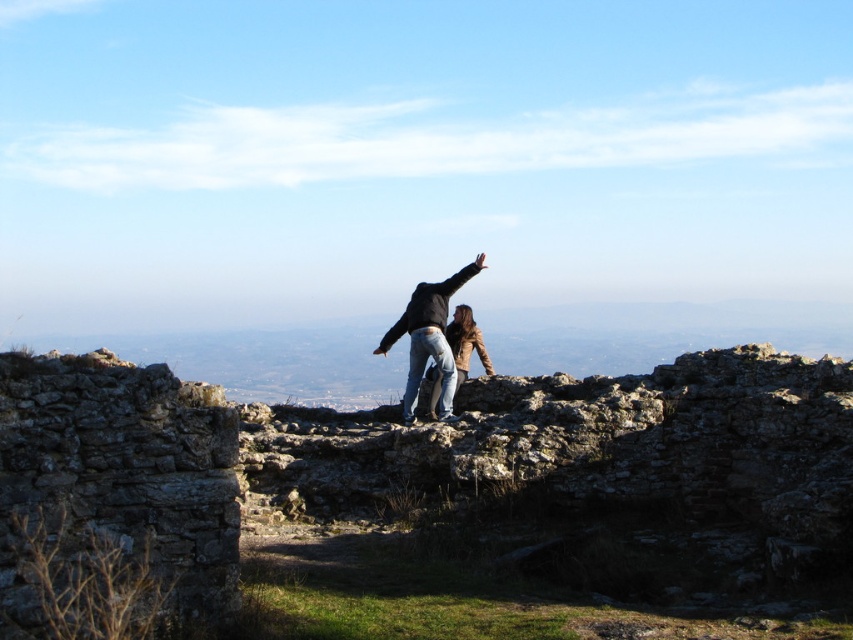
Consider the image. You are planning to place a small flag on the rustic stone ruins at center. Given that the ruins are at coordinates point 0.780, 0.537, can you confirm the exact location where the flag should be placed?

The rustic stone ruins at center are located at point (x=457, y=499), so the flag should be placed there.

Looking at this image, you are a photographer trying to capture a photo of the jeans at center and the leather jacket at center. Which one will be in focus if you focus on the foreground?

The jeans at center will be in focus because it is positioned in front of the leather jacket at center, so focusing on the foreground would prioritize the jeans at center.

You are a photographer standing at the base of the rustic stone ruins at center. You want to capture a photo that includes both the ruins and the two people standing on top. The camera you are using has a maximum focus range of 30 feet. Can you take the photo without moving closer to the ruins?

The rustic stone ruins at center are 30.45 feet away from the camera. Since the camera can only focus up to 30 feet, the distance is slightly beyond its range. Therefore, you cannot take the photo without moving closer to the ruins.